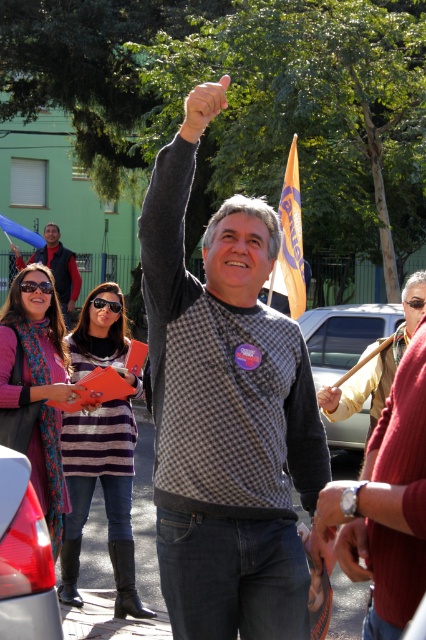
Looking at this image, you are standing in the outdoor scene and want to touch the two points shown in the image. Which point, point (236, 628) or point (373, 416), will you reach first if you move towards them?

Point (236, 628) is closer to the viewer than point (373, 416), so you will reach point (236, 628) first.

You are a photographer trying to capture the entire scene in one shot. Given that the leather jacket at center and the blue fabric flag at upper left are part of the composition, which object should be placed closer to the camera to ensure both are fully visible in the photo?

The leather jacket at center should be placed closer to the camera because it is much taller than the blue fabric flag at upper left, so positioning it nearer will help maintain both objects within the frame without cropping either.